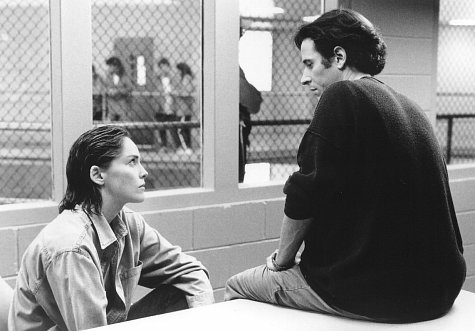
This screenshot has width=475, height=331. I want to click on chair, so click(x=11, y=292).